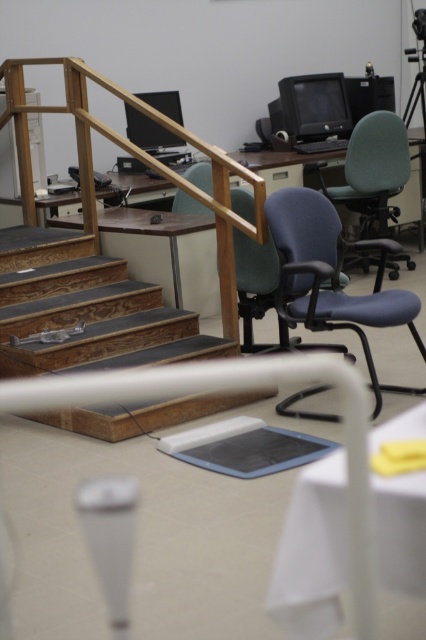
You are standing at the desk in the office scene and want to move towards the staircase. There are two points marked in the image, point A at coordinates point (169, 352) and point B at coordinates point (313, 211). Which point should you move towards to reach the staircase first?

Point A at coordinates point (169, 352) is behind point B at coordinates point (313, 211), so you should move towards point B first to reach the staircase.